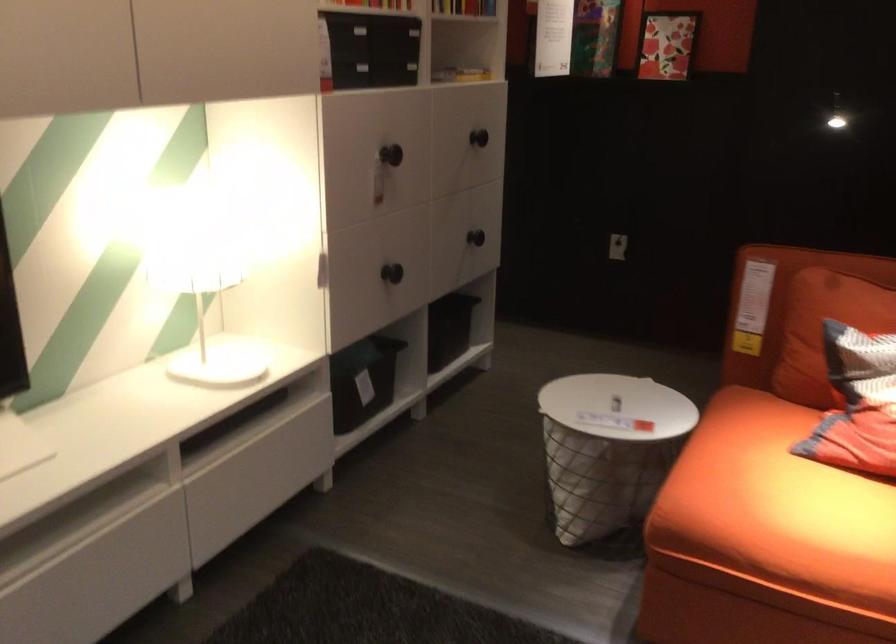
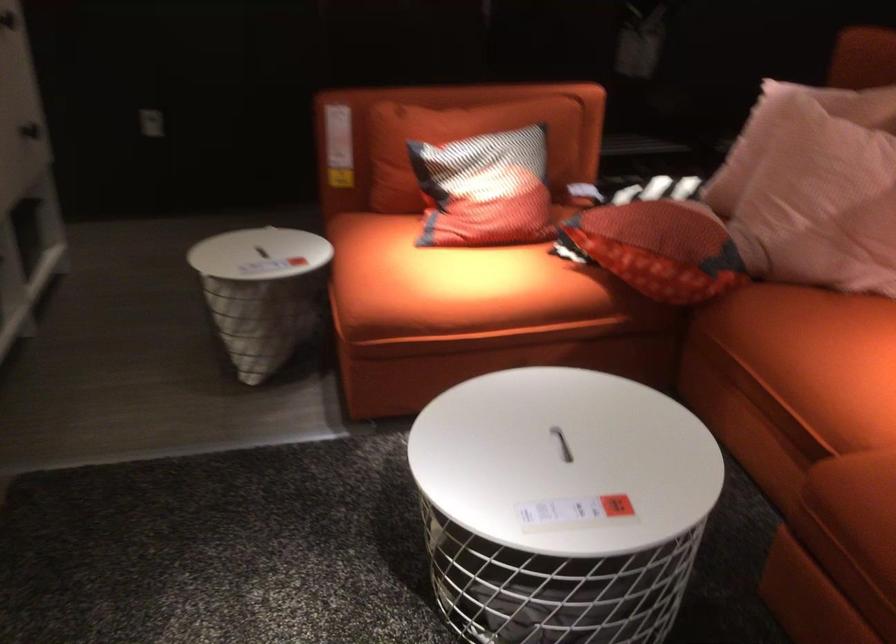
Where in the second image is the point corresponding to point 799,509 from the first image?

(449, 281)